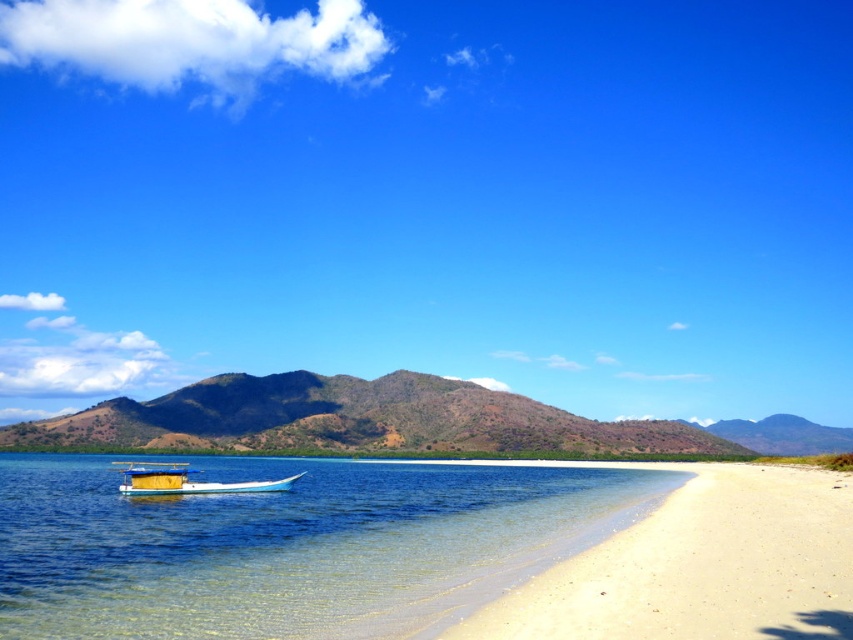
Does point (529, 620) come behind point (206, 492)?

No, (529, 620) is in front of (206, 492).

Which is in front, point (573, 611) or point (126, 493)?

Positioned in front is point (573, 611).

I want to click on white sandy beach at lower right, so click(700, 566).

Does clear water at lower left have a greater height compared to brown/drymountain at center?

Incorrect, clear water at lower left's height is not larger of brown/drymountain at center's.

Describe the element at coordinates (289, 545) in the screenshot. I see `clear water at lower left` at that location.

Where is `clear water at lower left`? This screenshot has width=853, height=640. clear water at lower left is located at coordinates (289, 545).

Can you confirm if clear water at lower left is bigger than white sandy beach at lower right?

Yes.

Identify the location of clear water at lower left. (289, 545).